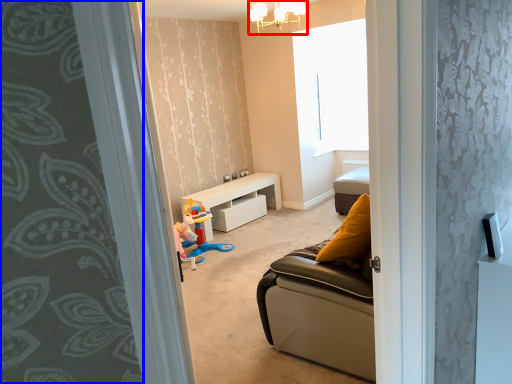
Question: Which of the following is the closest to the observer, light fixture (highlighted by a red box) or curtain (highlighted by a blue box)?

Choices:
 (A) light fixture
 (B) curtain

Answer: (B)